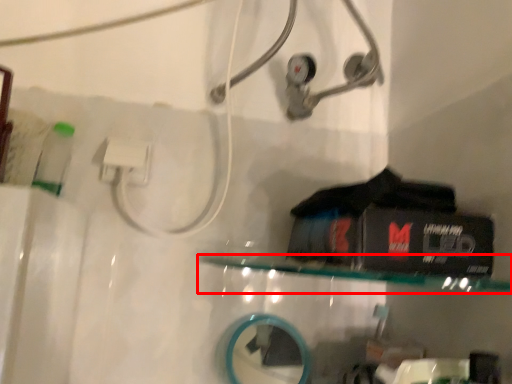
Question: From the image's perspective, what is the correct spatial relationship of shelf (annotated by the red box) in relation to mirror?

Choices:
 (A) above
 (B) below

Answer: (A)